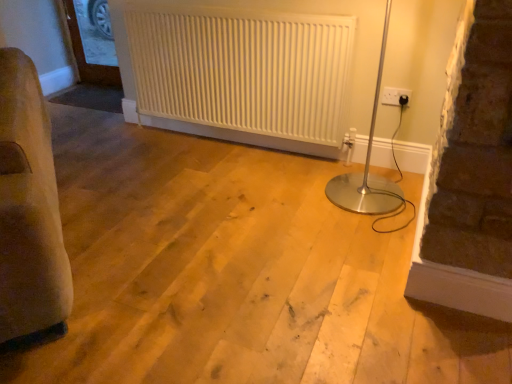
Question: Is white textured radiator at center far from clear glass door at upper left?

Choices:
 (A) yes
 (B) no

Answer: (A)

Question: From the image's perspective, does white textured radiator at center appear lower than clear glass door at upper left?

Choices:
 (A) yes
 (B) no

Answer: (A)

Question: Is white textured radiator at center aimed at clear glass door at upper left?

Choices:
 (A) yes
 (B) no

Answer: (B)

Question: Considering the relative sizes of white textured radiator at center and clear glass door at upper left in the image provided, is white textured radiator at center bigger than clear glass door at upper left?

Choices:
 (A) no
 (B) yes

Answer: (B)

Question: Does white textured radiator at center lie behind clear glass door at upper left?

Choices:
 (A) yes
 (B) no

Answer: (B)

Question: Is white plastic electric outlet at upper right taller or shorter than clear glass door at upper left?

Choices:
 (A) short
 (B) tall

Answer: (A)

Question: From a real-world perspective, relative to clear glass door at upper left, is white plastic electric outlet at upper right vertically above or below?

Choices:
 (A) above
 (B) below

Answer: (A)

Question: From the image's perspective, relative to clear glass door at upper left, is white plastic electric outlet at upper right above or below?

Choices:
 (A) below
 (B) above

Answer: (A)

Question: Is white plastic electric outlet at upper right wider or thinner than clear glass door at upper left?

Choices:
 (A) wide
 (B) thin

Answer: (B)

Question: Is clear glass door at upper left inside the boundaries of white textured radiator at center, or outside?

Choices:
 (A) inside
 (B) outside

Answer: (B)

Question: Based on their positions, is clear glass door at upper left located to the left or right of white textured radiator at center?

Choices:
 (A) left
 (B) right

Answer: (A)

Question: From the image's perspective, is clear glass door at upper left located above or below white textured radiator at center?

Choices:
 (A) above
 (B) below

Answer: (A)

Question: Is point (108, 18) closer or farther from the camera than point (184, 24)?

Choices:
 (A) closer
 (B) farther

Answer: (B)

Question: From their relative heights in the image, would you say clear glass door at upper left is taller or shorter than white plastic electric outlet at upper right?

Choices:
 (A) tall
 (B) short

Answer: (A)

Question: Considering their positions, is clear glass door at upper left located in front of or behind white plastic electric outlet at upper right?

Choices:
 (A) behind
 (B) front

Answer: (A)